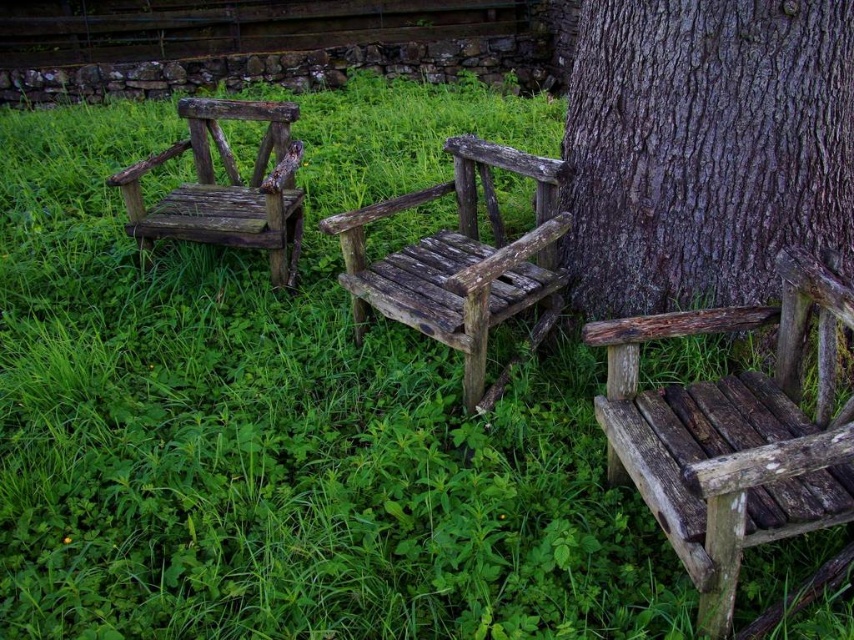
Question: In this image, where is weathered wood bench at right located relative to weathered wood chair at center?

Choices:
 (A) above
 (B) below

Answer: (B)

Question: Can you confirm if dark brown textured bark at right is smaller than weathered wood chair at center?

Choices:
 (A) no
 (B) yes

Answer: (A)

Question: Which of the following is the closest to the observer?

Choices:
 (A) weathered wood chair at center
 (B) dark brown textured bark at right

Answer: (A)

Question: Does weathered wood chair at center appear over weathered wood chair at left?

Choices:
 (A) yes
 (B) no

Answer: (B)

Question: Which point is closer to the camera?

Choices:
 (A) (656, 392)
 (B) (723, 29)
 (C) (461, 173)

Answer: (A)

Question: Which of the following is the closest to the observer?

Choices:
 (A) weathered wood bench at right
 (B) weathered wood chair at left
 (C) dark brown textured bark at right
 (D) weathered wood chair at center

Answer: (A)